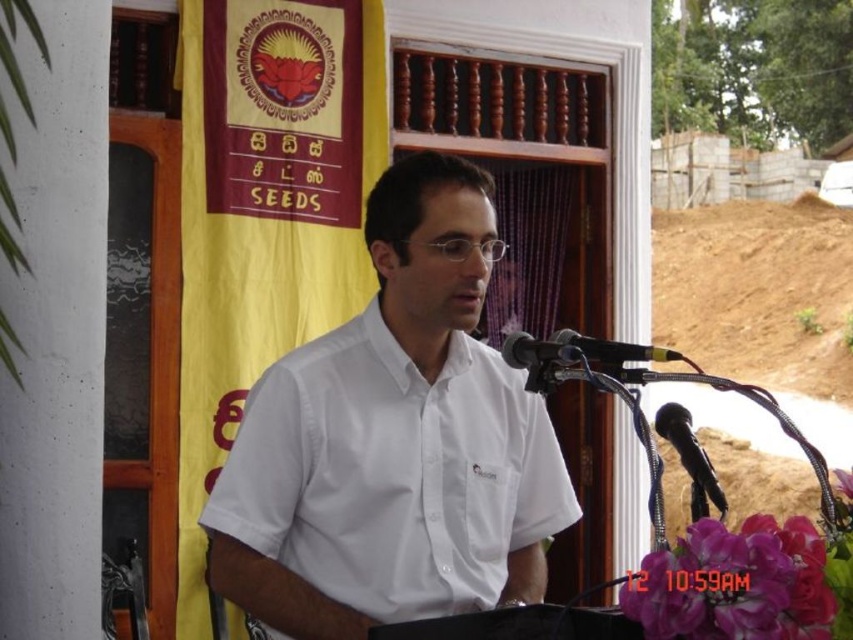
You are a photographer standing at a distance. You want to take a photo of the white smooth shirt at center and the black plastic microphone at center so that both are clearly visible in the frame. Given that the minimum distance between objects in your camera frame must be at least 22 inches to avoid blurring, will this setup work?

The white smooth shirt at center and black plastic microphone at center are 21.98 inches apart from each other. Since the required minimum distance is 22 inches to avoid blurring, the setup will not work as the distance is slightly less than required.

You are a photographer trying to capture the speaker at the podium. You notice the white smooth shirt at center and the black metallic microphone at center. Which object is located lower in the image?

The white smooth shirt at center is positioned under the black metallic microphone at center, so it is located lower in the image.